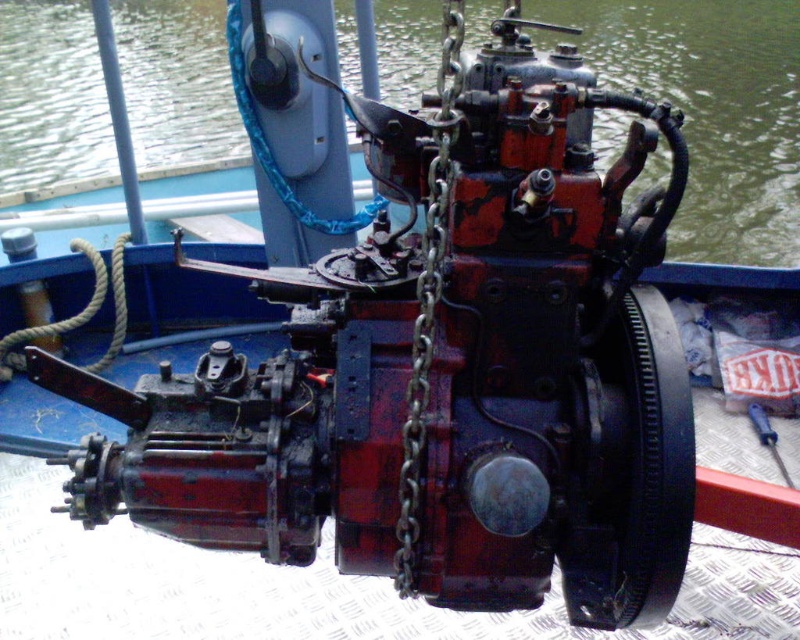
Question: Among these points, which one is farthest from the camera?

Choices:
 (A) (226, 92)
 (B) (436, 225)

Answer: (A)

Question: Which point is closer to the camera?

Choices:
 (A) (720, 52)
 (B) (426, 346)

Answer: (B)

Question: Does rusty metal engine at center have a lesser width compared to rusty metal chain at center?

Choices:
 (A) no
 (B) yes

Answer: (A)

Question: Is rusty metal engine at center bigger than rusty metal chain at center?

Choices:
 (A) no
 (B) yes

Answer: (B)

Question: Is rusty metal engine at center bigger than rusty metal chain at center?

Choices:
 (A) no
 (B) yes

Answer: (B)